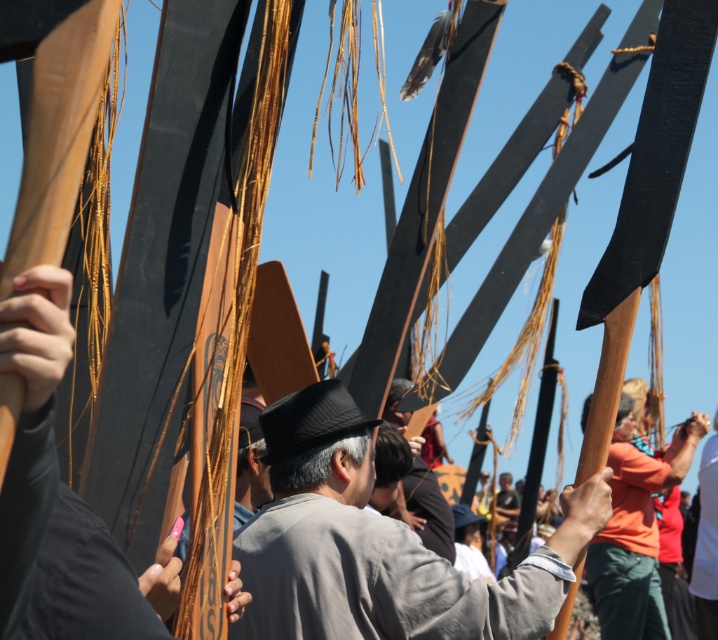
You are a photographer at the event and want to capture both the gray fabric shirt at center and the smooth brown leather jacket at lower right in a single frame. Which clothing item will appear larger in the photo?

The smooth brown leather jacket at lower right will appear larger in the photo because it is bigger than the gray fabric shirt at center.

From the picture: You are an observer at the event and need to determine which object takes up more area in the image between the dark gray fabric hat at center and the smooth brown leather jacket at lower right. Based on their positions and sizes, which one appears larger?

The smooth brown leather jacket at lower right occupies more space than the dark gray fabric hat at center, so it appears larger.

Based on the photo, you are a photographer trying to capture the scene of the ceremonial event. You notice the gray fabric shirt at center and the smooth brown leather jacket at lower right. Which object should you focus on if you want to photograph the one that is positioned more to the left?

The gray fabric shirt at center is positioned more to the left compared to the smooth brown leather jacket at lower right, so you should focus on the gray fabric shirt at center.